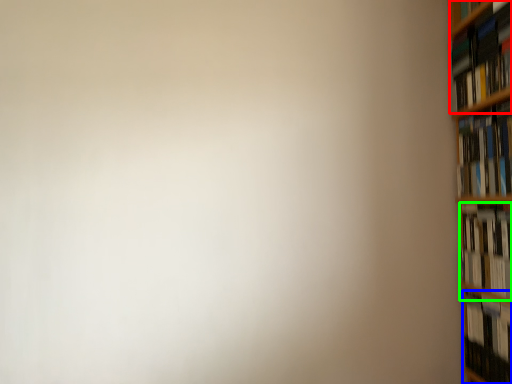
Question: Which object is positioned closest to book (highlighted by a red box)? Select from book (highlighted by a blue box) and book (highlighted by a green box).

Choices:
 (A) book
 (B) book

Answer: (B)